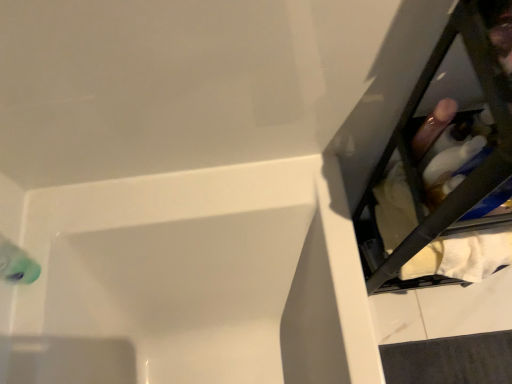
Question: Considering their positions, is white fabric at right located in front of or behind white glossy bathtub at lower left?

Choices:
 (A) front
 (B) behind

Answer: (A)

Question: From the image's perspective, is white fabric at right above or below white glossy bathtub at lower left?

Choices:
 (A) above
 (B) below

Answer: (A)

Question: From a real-world perspective, relative to white glossy bathtub at lower left, is white fabric at right vertically above or below?

Choices:
 (A) above
 (B) below

Answer: (A)

Question: In terms of width, does white glossy bathtub at lower left look wider or thinner when compared to white fabric at right?

Choices:
 (A) thin
 (B) wide

Answer: (B)

Question: Is white glossy bathtub at lower left inside or outside of white fabric at right?

Choices:
 (A) outside
 (B) inside

Answer: (A)

Question: Based on their sizes in the image, would you say white glossy bathtub at lower left is bigger or smaller than white fabric at right?

Choices:
 (A) big
 (B) small

Answer: (A)

Question: Considering the relative positions of white glossy bathtub at lower left and white fabric at right in the image provided, is white glossy bathtub at lower left to the left or to the right of white fabric at right?

Choices:
 (A) right
 (B) left

Answer: (B)